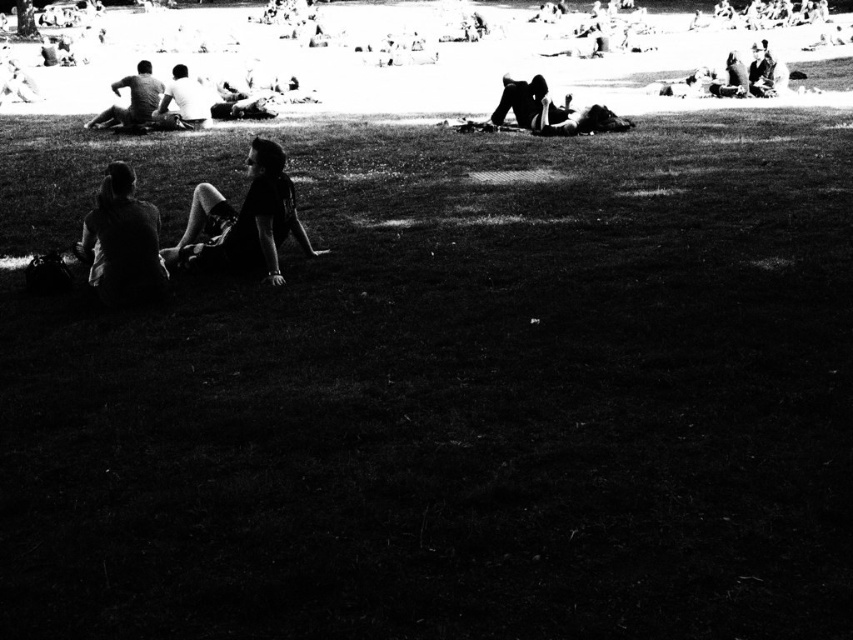
Question: Which of the following is the closest to the observer?

Choices:
 (A) dark fabric pants at center
 (B) dark fabric person at center
 (C) white matte shirt at upper center
 (D) smooth fabric person at upper right

Answer: (A)

Question: Does dark gray shirt at upper left have a smaller size compared to white matte shirt at upper center?

Choices:
 (A) no
 (B) yes

Answer: (A)

Question: Does dark gray shirt at upper left appear over smooth fabric person at upper right?

Choices:
 (A) no
 (B) yes

Answer: (B)

Question: Which point appears closest to the camera in this image?

Choices:
 (A) (555, 122)
 (B) (132, 289)
 (C) (538, 115)

Answer: (B)

Question: Is dark fabric pants at center thinner than dark fabric jacket at left?

Choices:
 (A) no
 (B) yes

Answer: (A)

Question: Among these objects, which one is farthest from the camera?

Choices:
 (A) smooth fabric person at upper right
 (B) dark gray shirt at upper left
 (C) dark fabric jacket at left
 (D) dark fabric pants at center

Answer: (B)